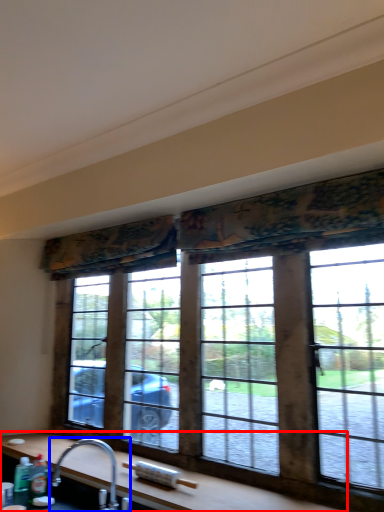
Question: Which point is closer to the camera, counter top (highlighted by a red box) or tap (highlighted by a blue box)?

Choices:
 (A) counter top
 (B) tap

Answer: (A)